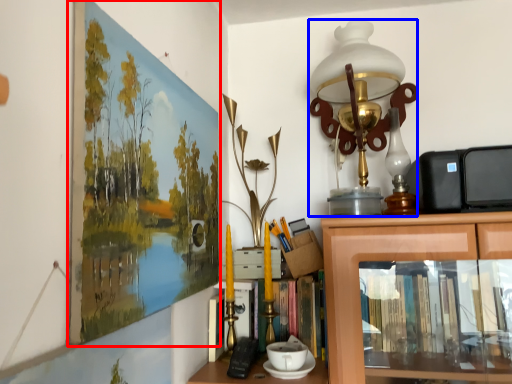
Question: Which object is further to the camera taking this photo, picture frame (highlighted by a red box) or table lamp (highlighted by a blue box)?

Choices:
 (A) picture frame
 (B) table lamp

Answer: (B)